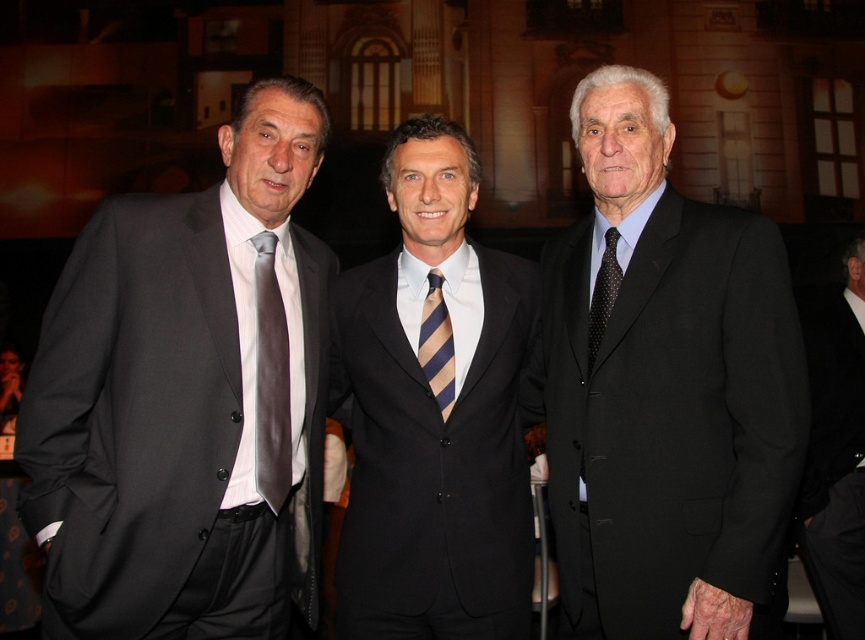
Is point (439, 317) closer to camera compared to point (844, 288)?

Yes.

Looking at this image, is the position of matte black suit at center more distant than that of black matte suit at right?

No, it is not.

Is point (505, 602) less distant than point (817, 474)?

Yes, it is in front of point (817, 474).

Find the location of `matte black suit at center`. matte black suit at center is located at coordinates (433, 412).

Is matte black suit at left closer to the viewer compared to matte gray tie at left?

Yes, matte black suit at left is in front of matte gray tie at left.

Who is more distant from viewer, (228, 476) or (274, 280)?

Point (274, 280)

The width and height of the screenshot is (865, 640). In order to click on matte black suit at left in this screenshot , I will do `click(186, 400)`.

Is black textured suit at right smaller than matte gray tie at left?

No, black textured suit at right is not smaller than matte gray tie at left.

Who is higher up, black textured suit at right or matte gray tie at left?

Positioned higher is black textured suit at right.

Which is in front, point (569, 589) or point (290, 422)?

Point (569, 589)

What are the coordinates of `black textured suit at right` in the screenshot? It's located at (668, 394).